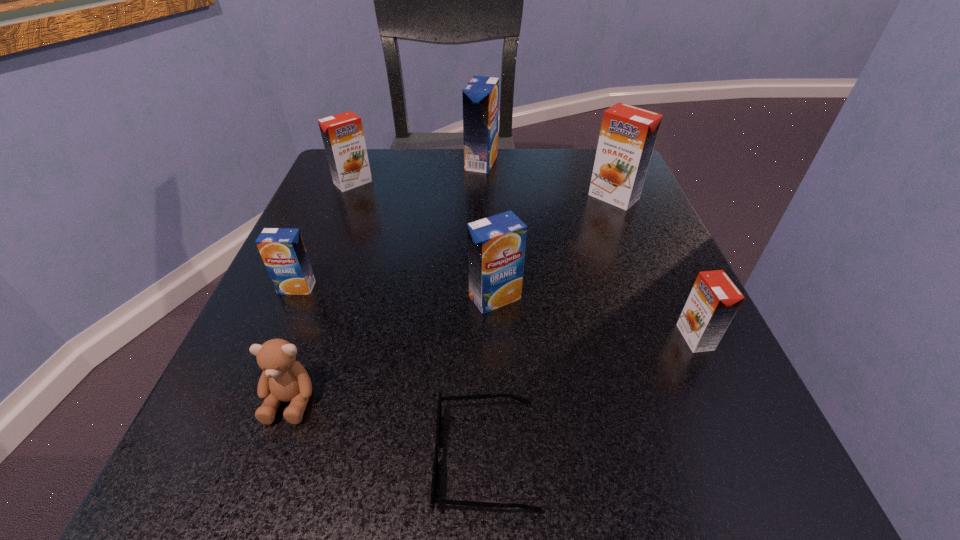
I want to click on the biggest blue orange_juice, so click(480, 96).

Where is `the biggest orange orange juice`? the biggest orange orange juice is located at coordinates (628, 134).

At what (x,y) coordinates should I click in order to perform the action: click on the leftmost orange orange juice. Please return your answer as a coordinate pair (x, y). The height and width of the screenshot is (540, 960). Looking at the image, I should click on (342, 134).

I want to click on the second smallest blue orange_juice, so click(x=496, y=245).

This screenshot has height=540, width=960. Find the location of `the leftmost blue orange_juice`. the leftmost blue orange_juice is located at coordinates (282, 249).

Locate an element on the screen. the nearest orange juice is located at coordinates (714, 299).

The width and height of the screenshot is (960, 540). Identify the location of the sixth farthest object. (714, 299).

Where is `brown teddy bear`? This screenshot has width=960, height=540. brown teddy bear is located at coordinates (283, 379).

You are a GUI agent. You are given a task and a screenshot of the screen. Output one action in this format:
    pyautogui.click(x=<x>, y=<y>)
    Task: Click on the sunglasses
    
    Given the screenshot: What is the action you would take?
    pyautogui.click(x=478, y=396)

Where is `the shortest object`? This screenshot has height=540, width=960. the shortest object is located at coordinates (478, 396).